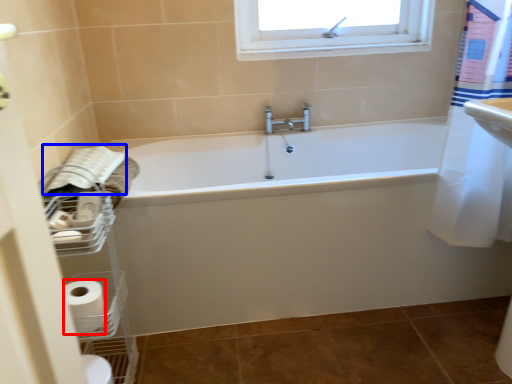
Question: Which of the following is the closest to the observer, toilet paper (highlighted by a red box) or bath towel (highlighted by a blue box)?

Choices:
 (A) toilet paper
 (B) bath towel

Answer: (A)